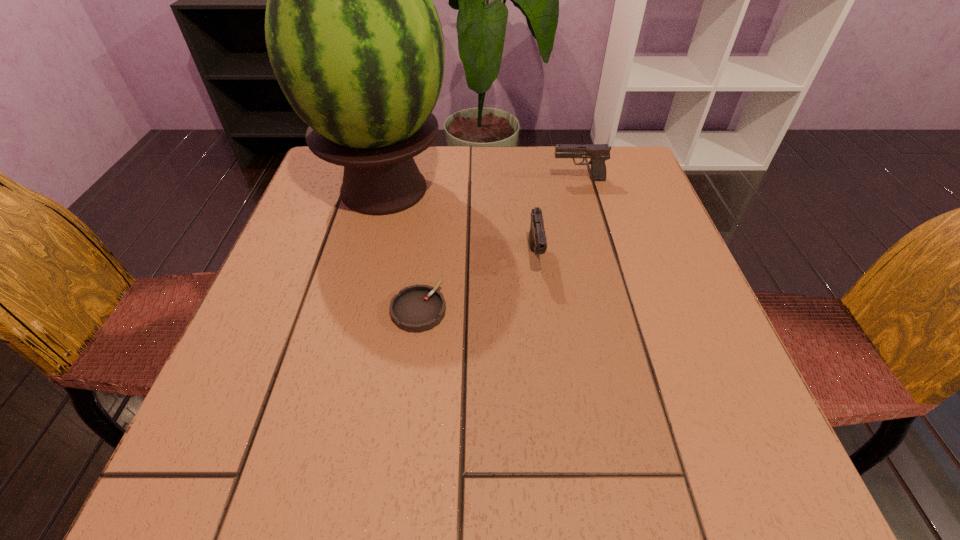
The width and height of the screenshot is (960, 540). In order to click on vacant space at the left edge in this screenshot , I will do `click(335, 329)`.

Find the location of a particular element. Image resolution: width=960 pixels, height=540 pixels. vacant space at the right edge of the desktop is located at coordinates (697, 388).

At what (x,y) coordinates should I click in order to perform the action: click on vacant region at the far left corner of the desktop. Please return your answer as a coordinate pair (x, y). Image resolution: width=960 pixels, height=540 pixels. Looking at the image, I should click on (323, 173).

Locate an element on the screen. This screenshot has width=960, height=540. vacant space at the near left corner is located at coordinates (287, 452).

Locate an element on the screen. blank space at the far right corner of the desktop is located at coordinates (645, 197).

This screenshot has width=960, height=540. I want to click on vacant space at the near right corner of the desktop, so click(x=781, y=475).

The image size is (960, 540). Find the location of `free space between the second nearest object and the farther pistol`. free space between the second nearest object and the farther pistol is located at coordinates (557, 218).

Find the location of a particular element. free spot between the shortest object and the rightmost object is located at coordinates [x=498, y=245].

This screenshot has height=540, width=960. What are the coordinates of `vacant point located between the ashtray and the rightmost object` in the screenshot? It's located at (498, 245).

Find the location of a particular element. Image resolution: width=960 pixels, height=540 pixels. free space between the nearer pistol and the farther pistol is located at coordinates (557, 218).